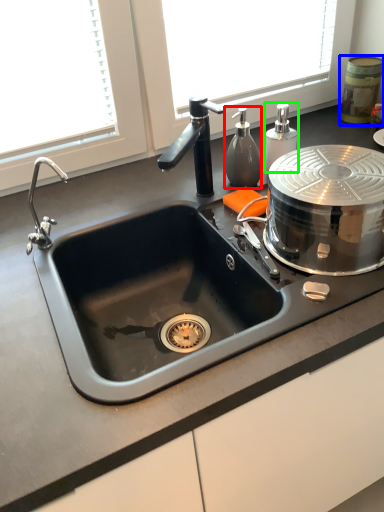
Question: Considering the real-world distances, which object is farthest from soap dispenser (highlighted by a red box)? appliance (highlighted by a blue box) or soap dispenser (highlighted by a green box)?

Choices:
 (A) appliance
 (B) soap dispenser

Answer: (A)